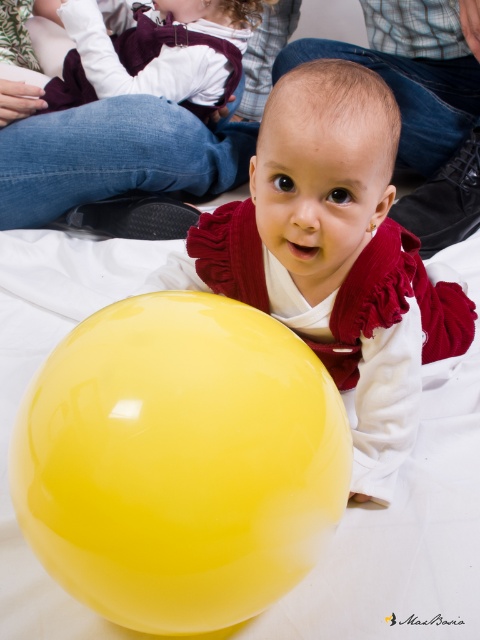
Question: Which point is farther to the camera?

Choices:
 (A) glossy yellow balloon at center
 (B) glossy yellow ball at lower left

Answer: (B)

Question: Can you confirm if glossy yellow balloon at center is positioned below glossy yellow ball at lower left?

Choices:
 (A) yes
 (B) no

Answer: (A)

Question: Does glossy yellow balloon at center come behind glossy yellow ball at lower left?

Choices:
 (A) no
 (B) yes

Answer: (A)

Question: Does glossy yellow balloon at center appear on the right side of glossy yellow ball at lower left?

Choices:
 (A) yes
 (B) no

Answer: (B)

Question: Which object is farther from the camera taking this photo?

Choices:
 (A) glossy yellow balloon at center
 (B) glossy yellow ball at lower left

Answer: (B)

Question: Among these objects, which one is farthest from the camera?

Choices:
 (A) glossy yellow balloon at center
 (B) glossy yellow ball at lower left

Answer: (B)